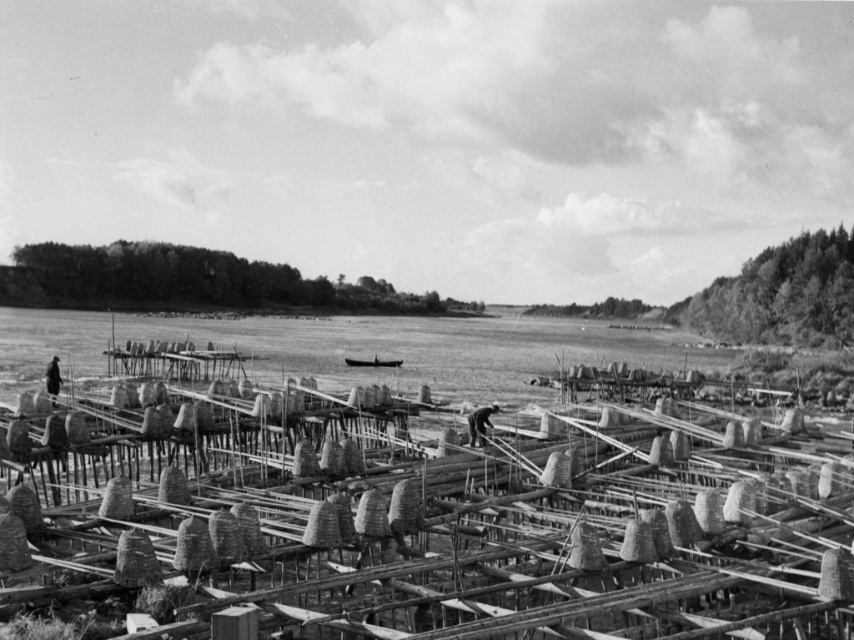
Question: Which is farther from the dark brown leather jacket at lower left?

Choices:
 (A) smooth wooden boat at center
 (B) dark gray fabric worker at center

Answer: (A)

Question: Does dark gray fabric worker at center appear under dark brown leather jacket at lower left?

Choices:
 (A) yes
 (B) no

Answer: (A)

Question: Is dark brown leather jacket at lower left bigger than smooth wooden boat at center?

Choices:
 (A) no
 (B) yes

Answer: (B)

Question: Which object is positioned farthest from the dark brown leather jacket at lower left?

Choices:
 (A) dark gray fabric worker at center
 (B) smooth wooden boat at center

Answer: (B)

Question: Observing the image, what is the correct spatial positioning of dark gray fabric worker at center in reference to dark brown leather jacket at lower left?

Choices:
 (A) left
 (B) right

Answer: (B)

Question: Which object appears farthest from the camera in this image?

Choices:
 (A) smooth wooden boat at center
 (B) dark brown leather jacket at lower left

Answer: (A)